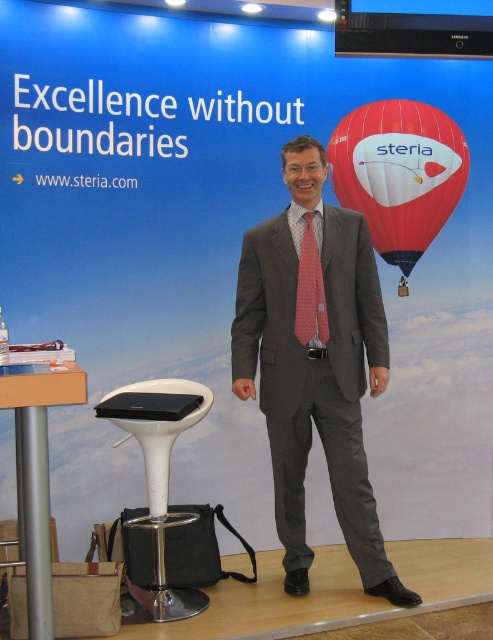
You are a photographer setting up for a group photo at the Steria booth. You want to position a white plastic bar stool at lower left and a pink dotted tie at center so that they are exactly 1 meter apart. Based on the current setup, do you need to move the stool closer or farther away from the tie?

The current distance between the white plastic bar stool at lower left and the pink dotted tie at center is 76.21 centimeters. Since 1 meter is 100 centimeters, you need to move the white plastic bar stool at lower left farther away from the pink dotted tie at center to reach the desired distance.

You are at a trade show booth for Steria. There is a point marked at coordinates (398, 173). What object is located at that point?

The point at coordinates (398, 173) indicates the red glossy hot air balloon at upper right.